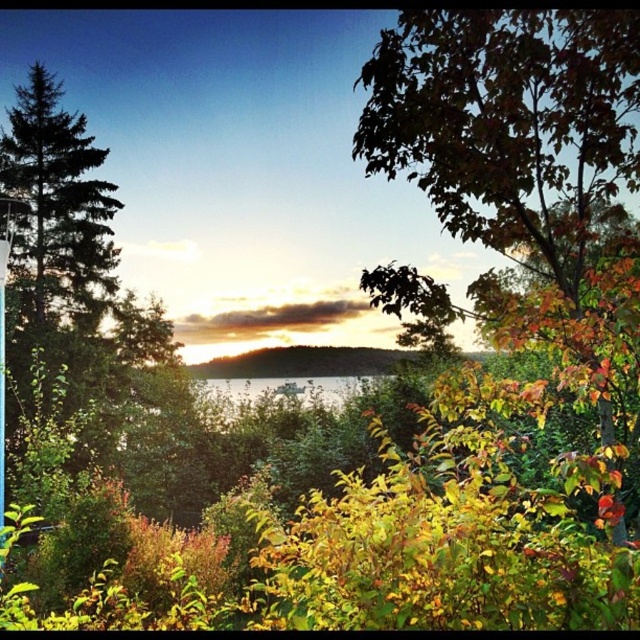
You are standing at the center of the image and want to pick up the autumn leaves at right. In which direction should you move to reach them?

The autumn leaves at right are located at point 0.198 on the x axis and 0.798 on the y axis. Since you are at the center, which is at point 0.5 on both axes, you should move to the left and down to reach them.

You are standing at the lakeside and want to pick up the autumn leaves at right. Which direction should you move to reach them without crossing the clear water at center?

The autumn leaves at right are in front of the clear water at center, so you should move towards the right side of the scene where the autumn leaves are located, as they are positioned closer to your current position compared to the clear water at center.

You are an artist planning to paint the lakeside scene. You want to emphasize the autumn leaves at right and the clear water at center in your painting. Which element should you make larger to ensure it stands out more?

Since autumn leaves at right occupies less space than clear water at center, you should make the autumn leaves at right larger in your painting to ensure it stands out more.